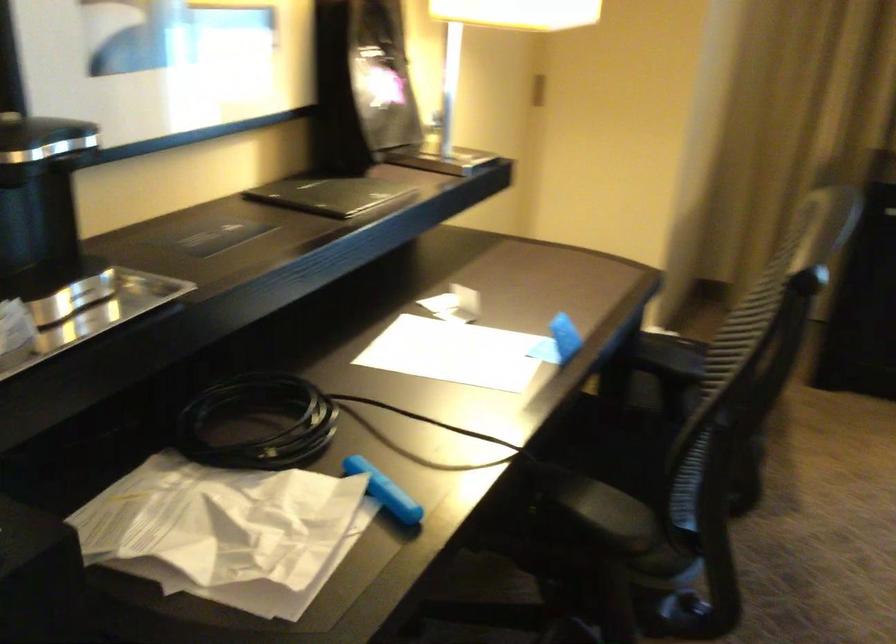
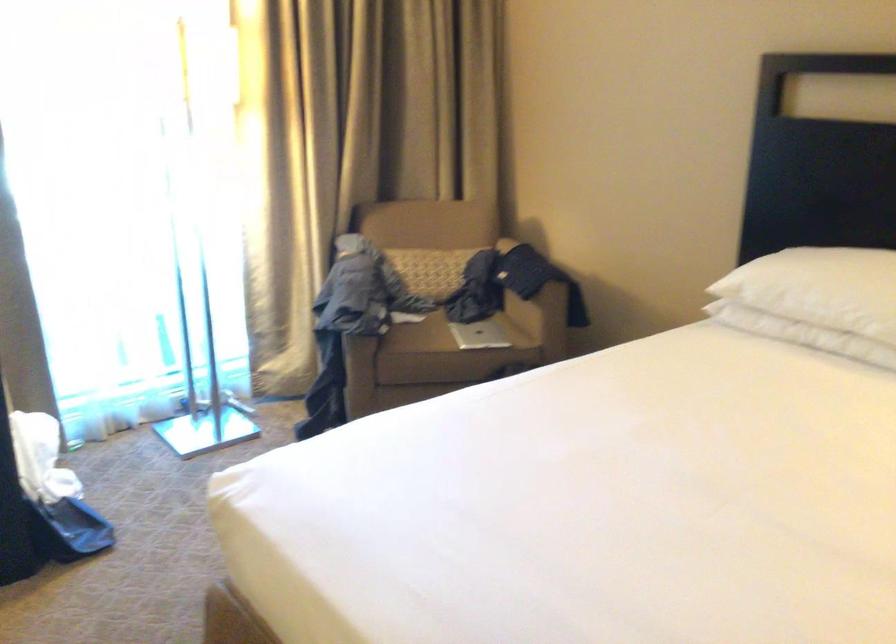
Question: The camera is either moving clockwise (left) or counter-clockwise (right) around the object. The first image is from the beginning of the video and the second image is from the end. Is the camera moving left or right when shooting the video?

Choices:
 (A) Left
 (B) Right

Answer: (A)